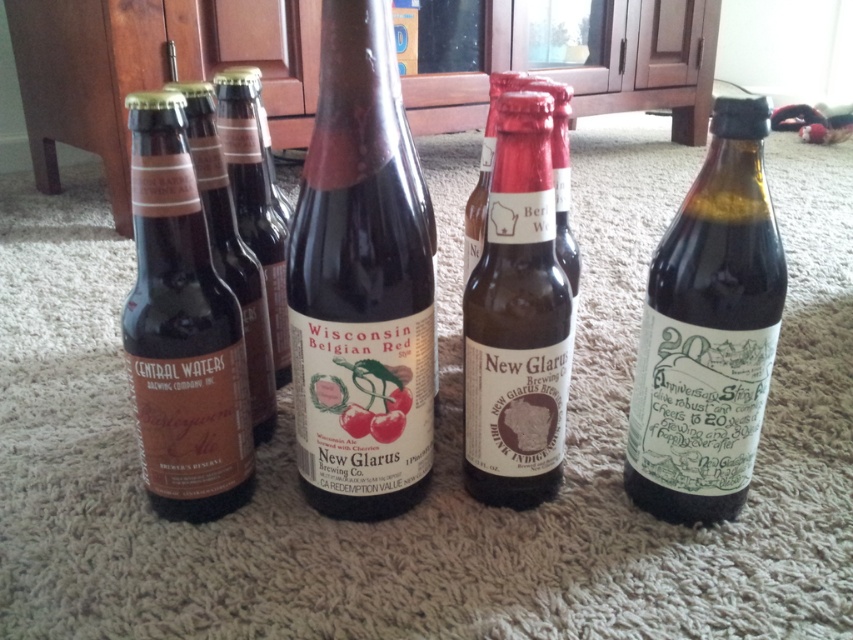
What is the coordinate of the dark brown glass bottle at center?

The dark brown glass bottle at center is located at coordinate point (358, 289).

You are arranging the bottles on the carpet and want to place a decorative item between the matte brown glass beer bottle at left and the brown glass bottle at center. Based on their positions, where should you place the item?

The matte brown glass beer bottle at left is below the brown glass bottle at center, so you should place the decorative item between them in the space above the matte brown glass beer bottle at left and below the brown glass bottle at center.

You are a delivery person who needs to place a new beer bottle between the existing ones. The new bottle is 12 inches long. Can you fit it between the matte brown glass beer bottle at left and the matte brown bottle at center without moving the existing bottles?

The distance between the matte brown glass beer bottle at left and the matte brown bottle at center is 13.31 inches. Since the new bottle is 12 inches long, it can fit in the space between them as the available space is larger than the bottle.